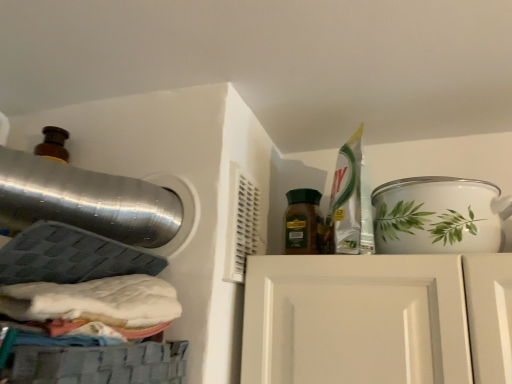
Question: Is green matte jar at center next to white ceramic pot at upper right?

Choices:
 (A) no
 (B) yes

Answer: (A)

Question: Considering the relative sizes of green matte jar at center and white ceramic pot at upper right in the image provided, is green matte jar at center thinner than white ceramic pot at upper right?

Choices:
 (A) yes
 (B) no

Answer: (A)

Question: Does green matte jar at center have a smaller size compared to white ceramic pot at upper right?

Choices:
 (A) no
 (B) yes

Answer: (B)

Question: Is green matte jar at center aimed at white ceramic pot at upper right?

Choices:
 (A) yes
 (B) no

Answer: (B)

Question: From a real-world perspective, is green matte jar at center located beneath white ceramic pot at upper right?

Choices:
 (A) yes
 (B) no

Answer: (B)

Question: Is green matte jar at center turned away from white ceramic pot at upper right?

Choices:
 (A) no
 (B) yes

Answer: (A)

Question: Is white ceramic pot at upper right further to the viewer compared to green matte jar at center?

Choices:
 (A) yes
 (B) no

Answer: (B)

Question: Considering the relative sizes of white ceramic pot at upper right and green matte jar at center in the image provided, is white ceramic pot at upper right wider than green matte jar at center?

Choices:
 (A) no
 (B) yes

Answer: (B)

Question: Is white ceramic pot at upper right aimed at green matte jar at center?

Choices:
 (A) no
 (B) yes

Answer: (A)

Question: Considering the relative sizes of white ceramic pot at upper right and green matte jar at center in the image provided, is white ceramic pot at upper right shorter than green matte jar at center?

Choices:
 (A) yes
 (B) no

Answer: (A)

Question: Is white ceramic pot at upper right bigger than green matte jar at center?

Choices:
 (A) no
 (B) yes

Answer: (B)

Question: Does white ceramic pot at upper right have a smaller size compared to green matte jar at center?

Choices:
 (A) no
 (B) yes

Answer: (A)

Question: In terms of width, does green matte jar at center look wider or thinner when compared to white ceramic pot at upper right?

Choices:
 (A) thin
 (B) wide

Answer: (A)